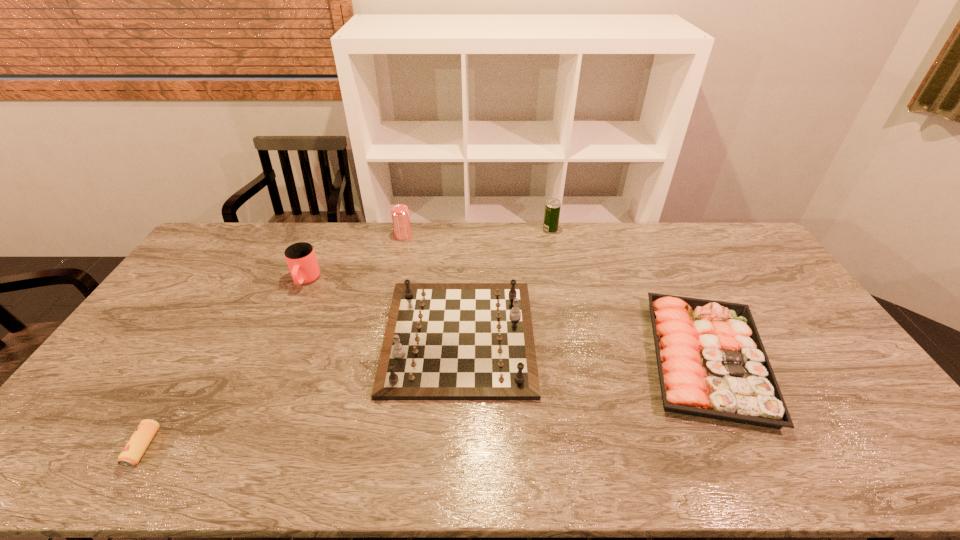
You are a GUI agent. You are given a task and a screenshot of the screen. Output one action in this format:
    pyautogui.click(x=<x>, y=<y>)
    Task: Click on the vacant space at the near left corner of the desktop
    This screenshot has width=960, height=540.
    Given the screenshot: What is the action you would take?
    pyautogui.click(x=121, y=441)

In the image, there is a desktop. In order to click on vacant space at the far right corner in this screenshot , I will do `click(711, 231)`.

The width and height of the screenshot is (960, 540). Identify the location of vacant area that lies between the rightmost beer can and the second beer can from left to right. (477, 233).

Identify the location of blank region between the rightmost beer can and the platter. (628, 294).

I want to click on vacant space in between the second beer can from right to left and the leftmost beer can, so click(x=274, y=341).

You are a GUI agent. You are given a task and a screenshot of the screen. Output one action in this format:
    pyautogui.click(x=<x>, y=<y>)
    Task: Click on the free space between the fourth tallest object and the cup
    The width and height of the screenshot is (960, 540).
    Given the screenshot: What is the action you would take?
    pyautogui.click(x=382, y=309)

The image size is (960, 540). I want to click on vacant area that lies between the second beer can from right to left and the leftmost beer can, so click(x=274, y=341).

In order to click on free spot between the second beer can from right to left and the second shortest object in this screenshot , I will do `click(555, 298)`.

Locate an element on the screen. This screenshot has width=960, height=540. object that ranks as the closest to the chessboard is located at coordinates (400, 213).

The image size is (960, 540). Find the location of `object that stands as the second closest to the leftmost object`. object that stands as the second closest to the leftmost object is located at coordinates (443, 341).